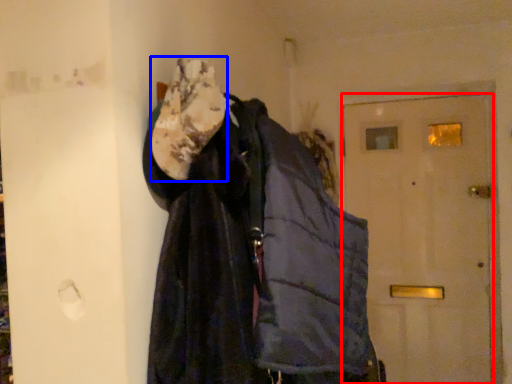
Question: Which of the following is the farthest to the observer, door (highlighted by a red box) or scarf (highlighted by a blue box)?

Choices:
 (A) door
 (B) scarf

Answer: (A)